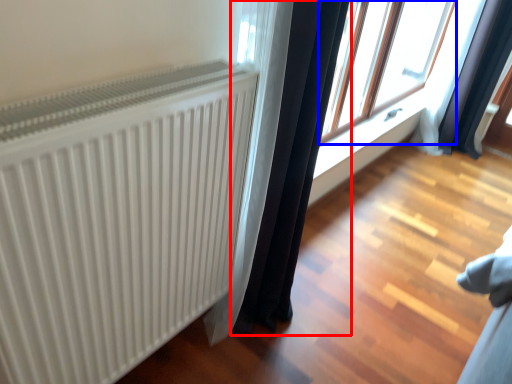
Question: Which point is further to the camera, curtain (highlighted by a red box) or window (highlighted by a blue box)?

Choices:
 (A) curtain
 (B) window

Answer: (B)